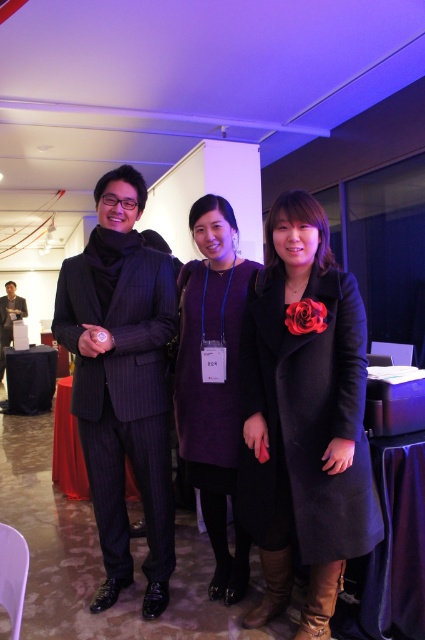
Between pinstriped wool suit at center and purple wool dress at center, which one is positioned lower?

Positioned lower is purple wool dress at center.

Does pinstriped wool suit at center have a smaller size compared to purple wool dress at center?

Actually, pinstriped wool suit at center might be larger than purple wool dress at center.

Locate an element on the screen. This screenshot has height=640, width=425. pinstriped wool suit at center is located at coordinates 122,381.

Can you confirm if pinstriped wool suit at center is positioned to the right of matte black suit at left?

Yes, pinstriped wool suit at center is to the right of matte black suit at left.

Is point (158, 420) behind point (14, 305)?

No.

This screenshot has width=425, height=640. I want to click on pinstriped wool suit at center, so click(122, 381).

Which of these two, black wool coat at center or matte black suit at left, stands shorter?

black wool coat at center

Between point (314, 282) and point (11, 324), which one is positioned in front?

Positioned in front is point (314, 282).

At what (x,y) coordinates should I click in order to perform the action: click on black wool coat at center. Please return your answer as a coordinate pair (x, y). Looking at the image, I should click on (306, 419).